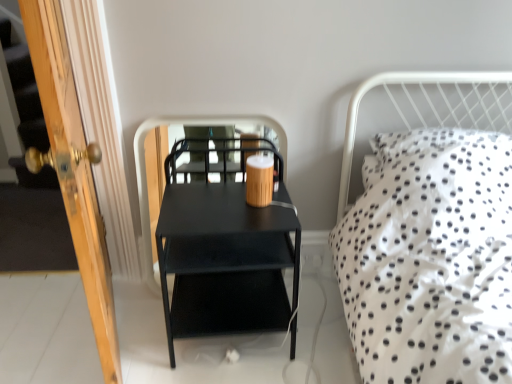
The width and height of the screenshot is (512, 384). I want to click on vacant space in matte black nightstand at center (from a real-world perspective), so click(x=236, y=343).